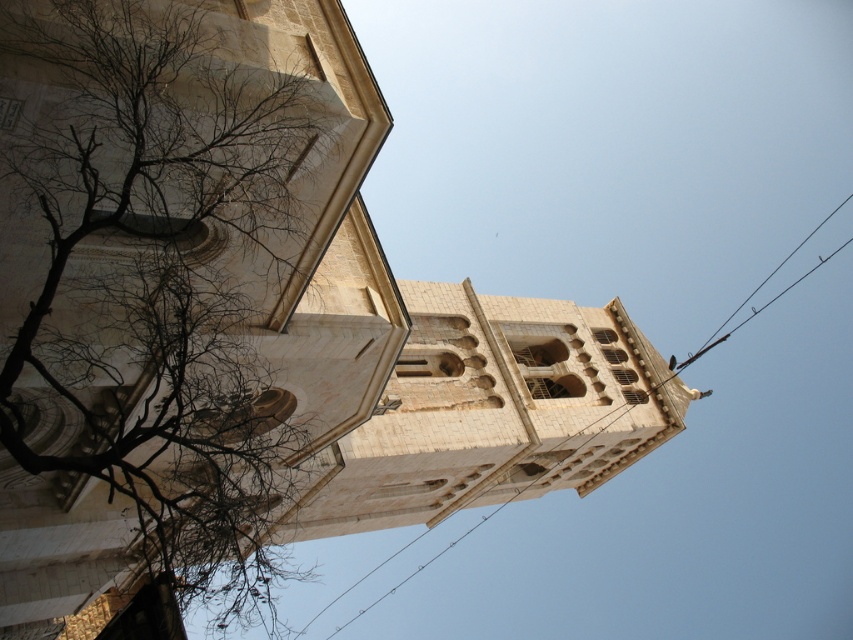
Is bare branches at left bigger than black wire at upper center?

No, bare branches at left is not bigger than black wire at upper center.

Can you confirm if bare branches at left is positioned above black wire at upper center?

Yes.

This screenshot has width=853, height=640. Describe the element at coordinates (154, 268) in the screenshot. I see `bare branches at left` at that location.

Locate an element on the screen. bare branches at left is located at coordinates (154, 268).

Who is positioned more to the right, bare branches at left or black wire at upper right?

black wire at upper right is more to the right.

Can you confirm if bare branches at left is taller than black wire at upper right?

Yes, bare branches at left is taller than black wire at upper right.

Is point (277, 48) positioned in front of point (821, 256)?

Yes, point (277, 48) is in front of point (821, 256).

Locate an element on the screen. This screenshot has height=640, width=853. bare branches at left is located at coordinates (154, 268).

Does black wire at upper center appear under black wire at upper right?

Indeed, black wire at upper center is positioned under black wire at upper right.

Who is more distant from viewer, (x=422, y=451) or (x=744, y=305)?

Point (x=744, y=305)

This screenshot has width=853, height=640. In order to click on black wire at upper center in this screenshot , I will do `click(498, 410)`.